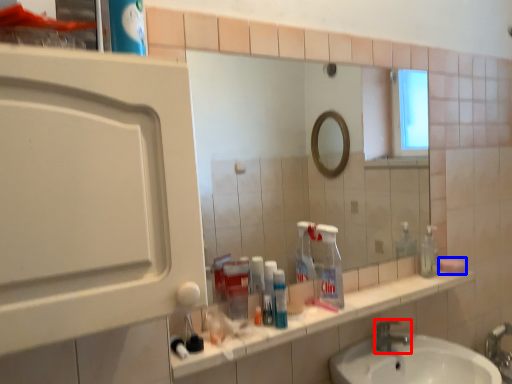
Question: Which object appears farthest to the camera in this image, tap (highlighted by a red box) or soap (highlighted by a blue box)?

Choices:
 (A) tap
 (B) soap

Answer: (B)